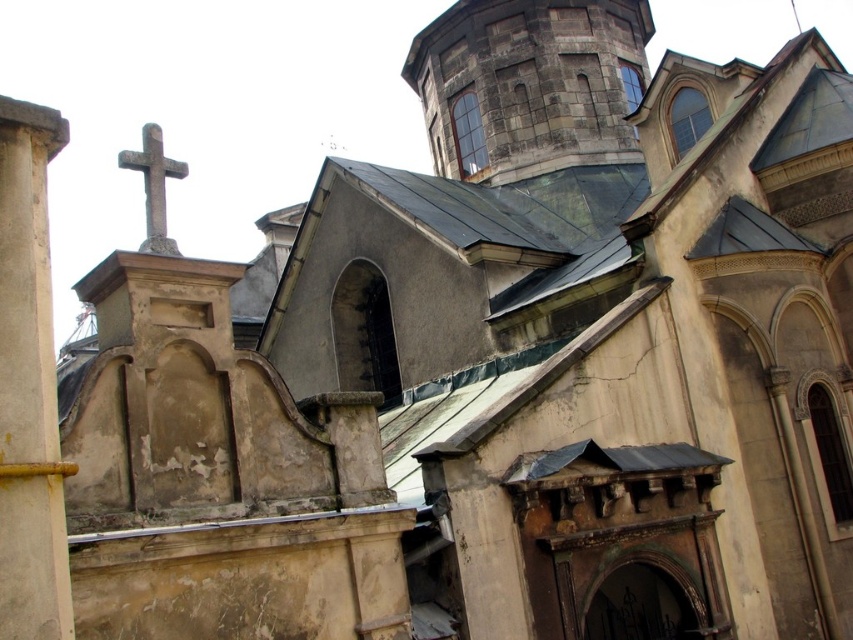
Question: Does yellow painted concrete column at left appear on the right side of smooth stone cross at upper left?

Choices:
 (A) no
 (B) yes

Answer: (B)

Question: Which object is closer to the camera taking this photo?

Choices:
 (A) yellow painted concrete column at left
 (B) smooth stone cross at upper left

Answer: (A)

Question: Is yellow painted concrete column at left bigger than smooth stone cross at upper left?

Choices:
 (A) no
 (B) yes

Answer: (A)

Question: Can you confirm if yellow painted concrete column at left is positioned to the right of smooth stone cross at upper left?

Choices:
 (A) no
 (B) yes

Answer: (B)

Question: Which of the following is the farthest from the observer?

Choices:
 (A) smooth stone cross at upper left
 (B) yellow painted concrete column at left

Answer: (A)